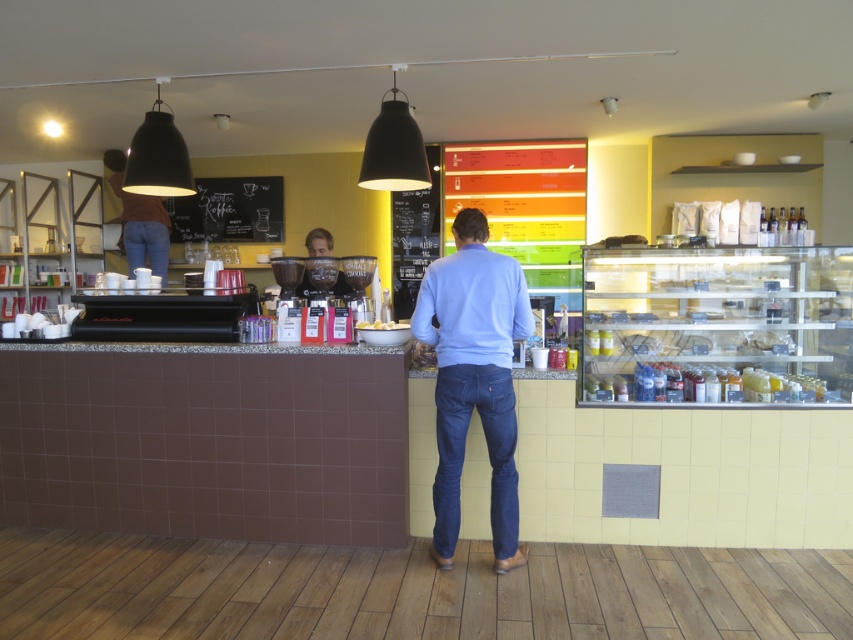
Question: Can you confirm if matte black coffee cup at center is positioned to the right of white glossy cake at center?

Choices:
 (A) no
 (B) yes

Answer: (A)

Question: In this image, where is chalkboard at center located relative to denim at left?

Choices:
 (A) below
 (B) above

Answer: (B)

Question: Can you confirm if dark blue denim jeans at center is bigger than white glossy cake at center?

Choices:
 (A) yes
 (B) no

Answer: (A)

Question: Which object is positioned closest to the denim at left?

Choices:
 (A) dark blue denim jeans at center
 (B) chalkboard at center

Answer: (B)

Question: Among these points, which one is farthest from the camera?

Choices:
 (A) (378, 326)
 (B) (434, 497)
 (C) (457, 364)
 (D) (218, 216)

Answer: (D)

Question: Which point is closer to the camera?

Choices:
 (A) (202, 204)
 (B) (512, 464)
 (C) (439, 532)

Answer: (B)